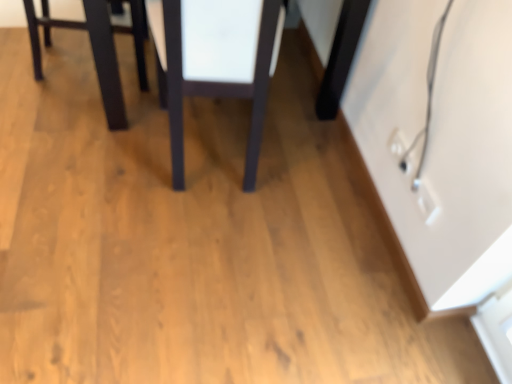
Question: Is matte dark wood table at center beside matte black table at upper left?

Choices:
 (A) no
 (B) yes

Answer: (A)

Question: Is matte dark wood table at center behind matte black table at upper left?

Choices:
 (A) no
 (B) yes

Answer: (A)

Question: Considering the relative sizes of matte dark wood table at center and matte black table at upper left in the image provided, is matte dark wood table at center shorter than matte black table at upper left?

Choices:
 (A) yes
 (B) no

Answer: (B)

Question: Considering the relative sizes of matte dark wood table at center and matte black table at upper left in the image provided, is matte dark wood table at center thinner than matte black table at upper left?

Choices:
 (A) yes
 (B) no

Answer: (B)

Question: Can you confirm if matte dark wood table at center is wider than matte black table at upper left?

Choices:
 (A) no
 (B) yes

Answer: (B)

Question: Could you tell me if matte dark wood table at center is facing matte black table at upper left?

Choices:
 (A) yes
 (B) no

Answer: (B)

Question: Would you say matte black table at upper left contains matte dark wood table at center?

Choices:
 (A) yes
 (B) no

Answer: (B)

Question: Is matte black table at upper left taller than matte dark wood table at center?

Choices:
 (A) yes
 (B) no

Answer: (B)

Question: Considering the relative sizes of matte black table at upper left and matte dark wood table at center in the image provided, is matte black table at upper left bigger than matte dark wood table at center?

Choices:
 (A) no
 (B) yes

Answer: (A)

Question: Is matte black table at upper left outside matte dark wood table at center?

Choices:
 (A) no
 (B) yes

Answer: (B)

Question: Is matte black table at upper left to the right of matte dark wood table at center from the viewer's perspective?

Choices:
 (A) no
 (B) yes

Answer: (A)

Question: Considering the relative sizes of matte black table at upper left and matte dark wood table at center in the image provided, is matte black table at upper left thinner than matte dark wood table at center?

Choices:
 (A) yes
 (B) no

Answer: (A)

Question: In terms of height, does matte black table at upper left look taller or shorter compared to matte dark wood table at center?

Choices:
 (A) tall
 (B) short

Answer: (B)